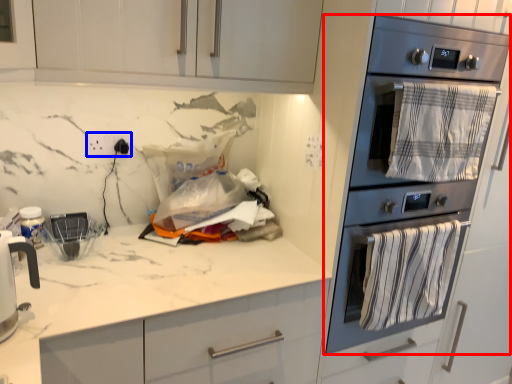
Question: Among these objects, which one is nearest to the camera, kitchen appliance (highlighted by a red box) or electric outlet (highlighted by a blue box)?

Choices:
 (A) kitchen appliance
 (B) electric outlet

Answer: (A)